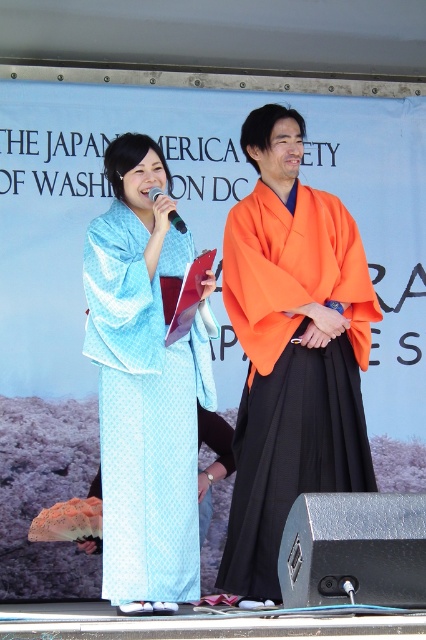
Does light blue silk kimono at center appear on the right side of black plastic microphone at center?

In fact, light blue silk kimono at center is to the left of black plastic microphone at center.

Is point (132, 301) closer to viewer compared to point (152, 200)?

That is True.

Between point (123, 513) and point (184, 228), which one is positioned in front?

Point (123, 513) is more forward.

Where is `light blue silk kimono at center`? The image size is (426, 640). light blue silk kimono at center is located at coordinates (144, 387).

Is point (155, 333) positioned behind point (311, 228)?

That is False.

Which is in front, point (192, 467) or point (325, 250)?

Point (192, 467) is more forward.

Describe the element at coordinates (144, 387) in the screenshot. I see `light blue silk kimono at center` at that location.

You are a GUI agent. You are given a task and a screenshot of the screen. Output one action in this format:
    pyautogui.click(x=<x>, y=<y>)
    Task: Click on the light blue silk kimono at center
    This screenshot has height=640, width=426.
    Given the screenshot: What is the action you would take?
    pyautogui.click(x=144, y=387)

Can you confirm if orange silk kimono at center is smaller than black plastic microphone at center?

No.

Between orange silk kimono at center and black plastic microphone at center, which one has more height?

With more height is orange silk kimono at center.

Does point (348, 296) lie behind point (176, 218)?

Yes, it is behind point (176, 218).

What are the coordinates of `orange silk kimono at center` in the screenshot? It's located at (x=291, y=371).